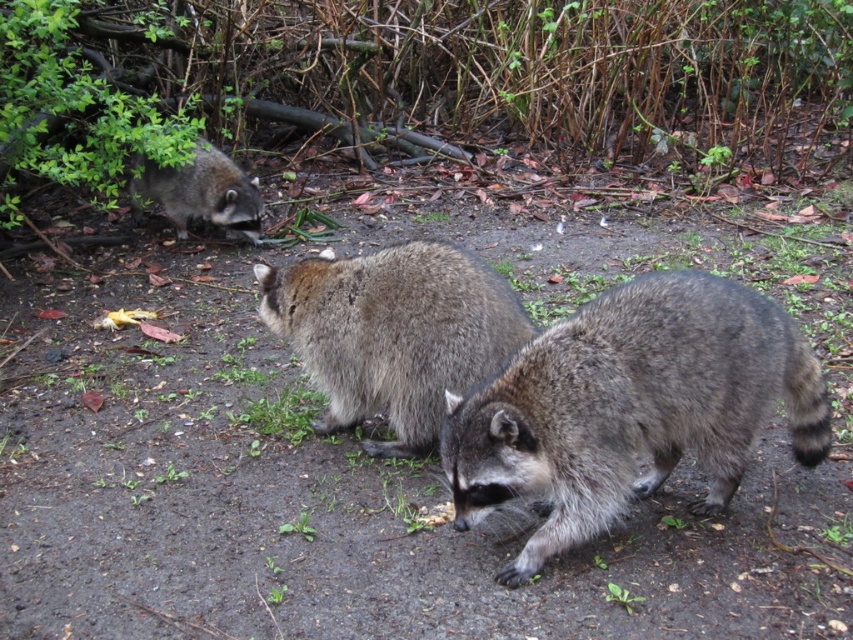
Question: Considering the real-world distances, which object is closest to the fuzzy gray raccoon at center?

Choices:
 (A) fuzzy brown raccoon at center
 (B) fuzzy brown raccoon at upper left

Answer: (A)

Question: Which is nearer to the fuzzy brown raccoon at center?

Choices:
 (A) fuzzy gray raccoon at center
 (B) fuzzy brown raccoon at upper left

Answer: (A)

Question: Which point is farther from the camera taking this photo?

Choices:
 (A) (144, 172)
 (B) (260, 298)

Answer: (A)

Question: Can you confirm if fuzzy gray raccoon at center is thinner than fuzzy brown raccoon at upper left?

Choices:
 (A) no
 (B) yes

Answer: (A)

Question: Where is fuzzy gray raccoon at center located in relation to fuzzy brown raccoon at upper left in the image?

Choices:
 (A) left
 (B) right

Answer: (B)

Question: Is fuzzy brown raccoon at center to the left of fuzzy brown raccoon at upper left from the viewer's perspective?

Choices:
 (A) yes
 (B) no

Answer: (B)